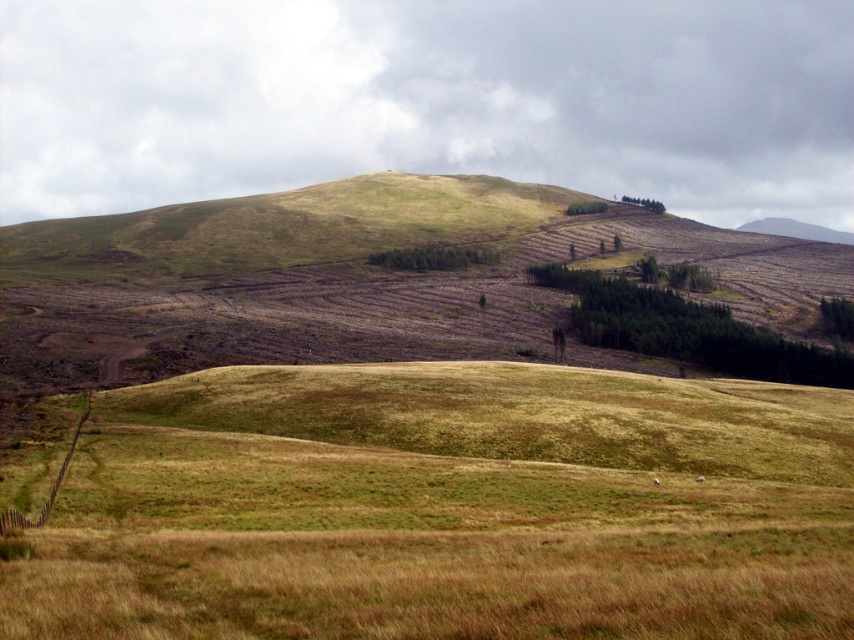
Question: Which of the following is the farthest from the observer?

Choices:
 (A) (661, 212)
 (B) (414, 248)
 (C) (540, 272)
 (D) (829, 324)

Answer: (A)

Question: Is green textured trees at center in front of green leafy tree at lower right?

Choices:
 (A) yes
 (B) no

Answer: (A)

Question: From the image, what is the correct spatial relationship of green coniferous trees at center in relation to green leafy trees at upper center?

Choices:
 (A) below
 (B) above

Answer: (A)

Question: Which of the following is the closest to the observer?

Choices:
 (A) (664, 208)
 (B) (583, 212)
 (C) (389, 257)

Answer: (C)

Question: Is green leafy trees at upper center further to the viewer compared to green matte trees at upper center?

Choices:
 (A) no
 (B) yes

Answer: (A)

Question: Which is farther from the green textured trees at center?

Choices:
 (A) green leafy trees at upper center
 (B) green leafy tree at lower right
 (C) green matte trees at upper center

Answer: (C)